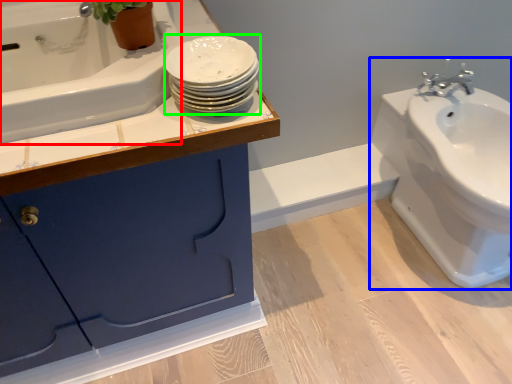
Question: Which object is positioned farthest from bath (highlighted by a red box)? Select from sink (highlighted by a blue box) and porcelain (highlighted by a green box).

Choices:
 (A) sink
 (B) porcelain

Answer: (A)